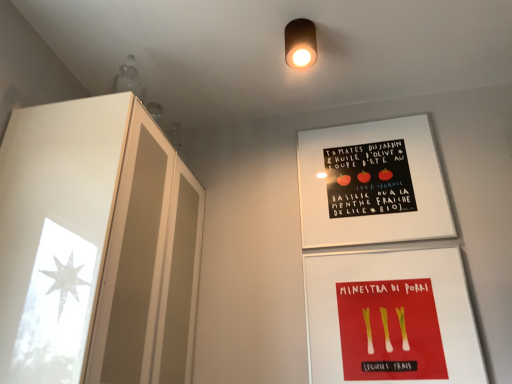
Question: Can you confirm if frosted glass cabinet at left is positioned to the right of matte brown cylinder at upper center?

Choices:
 (A) no
 (B) yes

Answer: (A)

Question: From a real-world perspective, is frosted glass cabinet at left beneath matte brown cylinder at upper center?

Choices:
 (A) no
 (B) yes

Answer: (B)

Question: Would you say frosted glass cabinet at left is a long distance from matte brown cylinder at upper center?

Choices:
 (A) yes
 (B) no

Answer: (B)

Question: Is frosted glass cabinet at left shorter than matte brown cylinder at upper center?

Choices:
 (A) yes
 (B) no

Answer: (B)

Question: From a real-world perspective, is frosted glass cabinet at left over matte brown cylinder at upper center?

Choices:
 (A) no
 (B) yes

Answer: (A)

Question: Considering the relative sizes of frosted glass cabinet at left and matte brown cylinder at upper center in the image provided, is frosted glass cabinet at left thinner than matte brown cylinder at upper center?

Choices:
 (A) no
 (B) yes

Answer: (A)

Question: Is white matte poster at upper center smaller than frosted glass cabinet at left?

Choices:
 (A) no
 (B) yes

Answer: (B)

Question: Can you confirm if white matte poster at upper center is positioned to the left of frosted glass cabinet at left?

Choices:
 (A) no
 (B) yes

Answer: (A)

Question: Can you confirm if white matte poster at upper center is positioned to the right of frosted glass cabinet at left?

Choices:
 (A) no
 (B) yes

Answer: (B)

Question: From the image's perspective, does white matte poster at upper center appear higher than frosted glass cabinet at left?

Choices:
 (A) yes
 (B) no

Answer: (A)

Question: From the image's perspective, is white matte poster at upper center under frosted glass cabinet at left?

Choices:
 (A) no
 (B) yes

Answer: (A)

Question: Does white matte poster at upper center have a larger size compared to frosted glass cabinet at left?

Choices:
 (A) no
 (B) yes

Answer: (A)

Question: Can you confirm if matte brown cylinder at upper center is smaller than white matte poster at upper center?

Choices:
 (A) yes
 (B) no

Answer: (A)